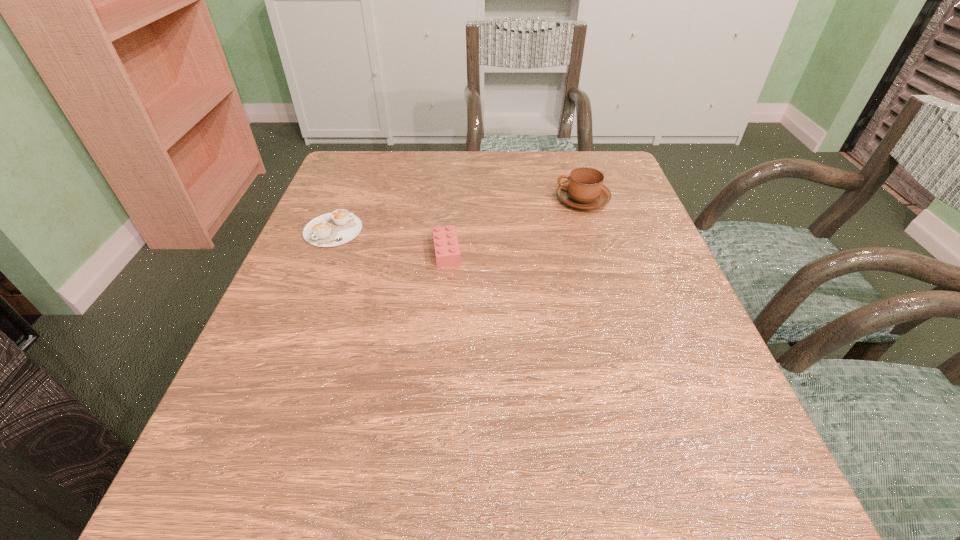
Image resolution: width=960 pixels, height=540 pixels. Find the location of `the right cappuccino`. the right cappuccino is located at coordinates (584, 189).

The image size is (960, 540). Find the location of `the rightmost object`. the rightmost object is located at coordinates (584, 189).

Locate an element on the screen. Image resolution: width=960 pixels, height=540 pixels. the second object from left to right is located at coordinates (447, 253).

This screenshot has width=960, height=540. What are the coordinates of `Lego` in the screenshot? It's located at (447, 253).

The image size is (960, 540). Find the location of `the leftmost object`. the leftmost object is located at coordinates (332, 229).

The height and width of the screenshot is (540, 960). I want to click on the shorter cappuccino, so click(x=332, y=229).

The height and width of the screenshot is (540, 960). Identify the location of vacant space located on the side of the right cappuccino with the handle. (515, 200).

You are a GUI agent. You are given a task and a screenshot of the screen. Output one action in this format:
    pyautogui.click(x=<x>, y=<y>)
    Task: Click on the vacant space located on the side of the right cappuccino with the handle
    
    Given the screenshot: What is the action you would take?
    pyautogui.click(x=419, y=200)

This screenshot has height=540, width=960. In order to click on vacant space located 0.060m on the side of the right cappuccino with the handle in this screenshot , I will do `click(531, 200)`.

What are the coordinates of `vacant point located 0.160m on the left of the Lego` in the screenshot? It's located at (354, 251).